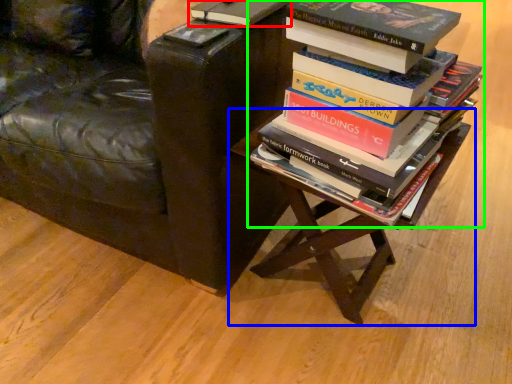
Question: Which object is positioned farthest from book (highlighted by a red box)? Select from table (highlighted by a blue box) and book (highlighted by a green box).

Choices:
 (A) table
 (B) book

Answer: (A)